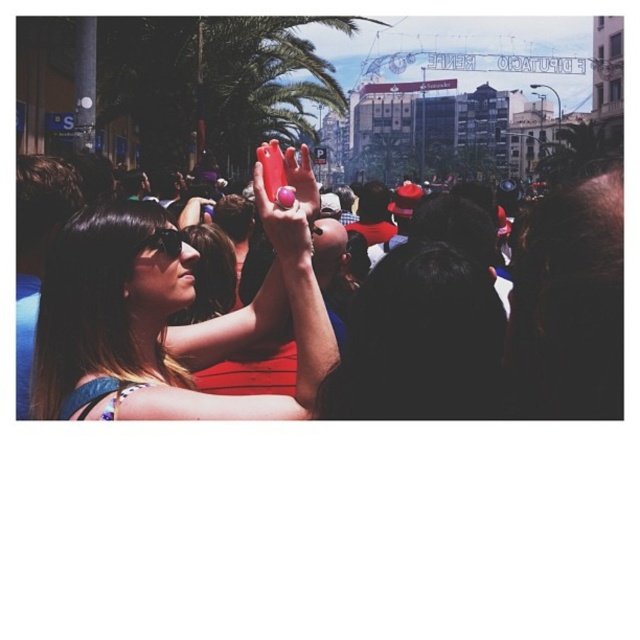
Question: Which point is farther to the camera?

Choices:
 (A) matte red phone at center
 (B) matte black goggles at center

Answer: (B)

Question: Which object appears closest to the camera in this image?

Choices:
 (A) matte red phone at center
 (B) matte black goggles at center

Answer: (A)

Question: Can you confirm if matte red phone at center is positioned to the left of matte black goggles at center?

Choices:
 (A) yes
 (B) no

Answer: (B)

Question: Does matte red phone at center appear on the right side of matte black goggles at center?

Choices:
 (A) yes
 (B) no

Answer: (A)

Question: Can you confirm if matte red phone at center is positioned below matte black goggles at center?

Choices:
 (A) no
 (B) yes

Answer: (B)